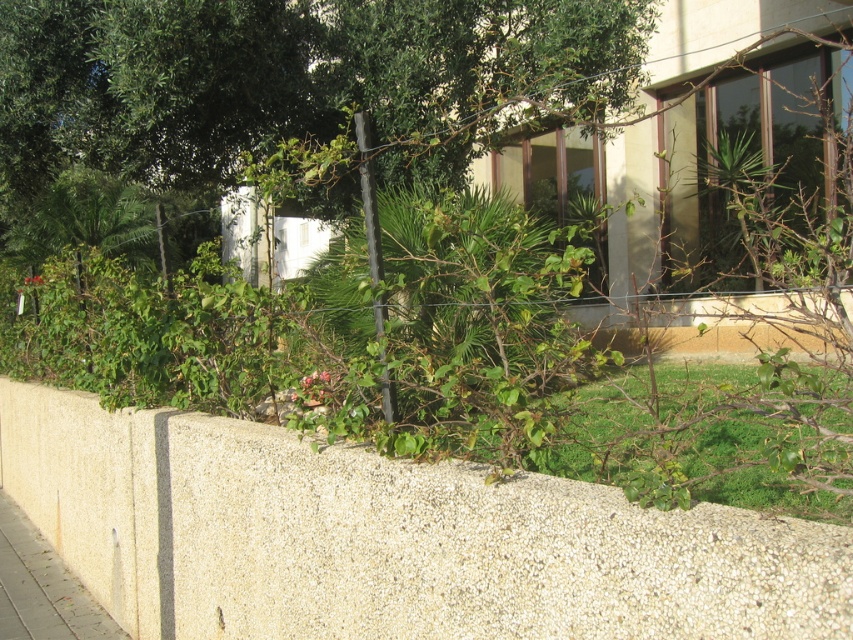
Between beige concrete wall at lower left and gray concrete pavement at lower left, which one appears on the left side from the viewer's perspective?

gray concrete pavement at lower left is more to the left.

Who is shorter, beige concrete wall at lower left or gray concrete pavement at lower left?

With less height is gray concrete pavement at lower left.

Which is in front, point (372, 458) or point (45, 609)?

Point (372, 458) is more forward.

I want to click on beige concrete wall at lower left, so click(387, 538).